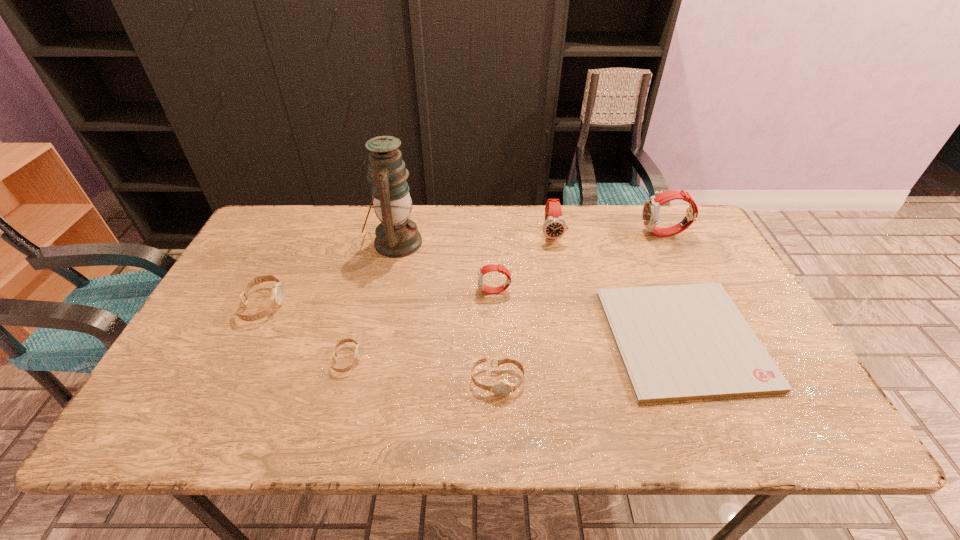
Identify the location of oil lamp. The image size is (960, 540). (397, 236).

Where is `the tallest object`? the tallest object is located at coordinates (397, 236).

You are a GUI agent. You are given a task and a screenshot of the screen. Output one action in this format:
    pyautogui.click(x=<x>, y=<y>)
    Task: Click on the rightmost watch
    This screenshot has width=960, height=540.
    Given the screenshot: What is the action you would take?
    650,214

Find the location of a particular element. The width and height of the screenshot is (960, 540). the second tallest object is located at coordinates (650, 214).

At what (x,y) coordinates should I click in order to perform the action: click on the fifth watch from left to right. Please return your answer as a coordinate pair (x, y). The width and height of the screenshot is (960, 540). Looking at the image, I should click on (554, 227).

You are a GUI agent. You are given a task and a screenshot of the screen. Output one action in this format:
    pyautogui.click(x=<x>, y=<y>)
    Task: Click on the third tallest object
    
    Given the screenshot: What is the action you would take?
    pyautogui.click(x=554, y=227)

You are a GUI agent. You are given a task and a screenshot of the screen. Output one action in this format:
    pyautogui.click(x=<x>, y=<y>)
    Task: Click on the fifth shortest object
    Image resolution: width=960 pixels, height=540 pixels.
    Given the screenshot: What is the action you would take?
    pyautogui.click(x=485, y=269)

The image size is (960, 540). Find the location of `the leftmost red watch`. the leftmost red watch is located at coordinates (485, 269).

What are the coordinates of `the leftmost object` in the screenshot? It's located at (x=278, y=291).

Image resolution: width=960 pixels, height=540 pixels. Find the location of `the fourth tallest watch`. the fourth tallest watch is located at coordinates (278, 291).